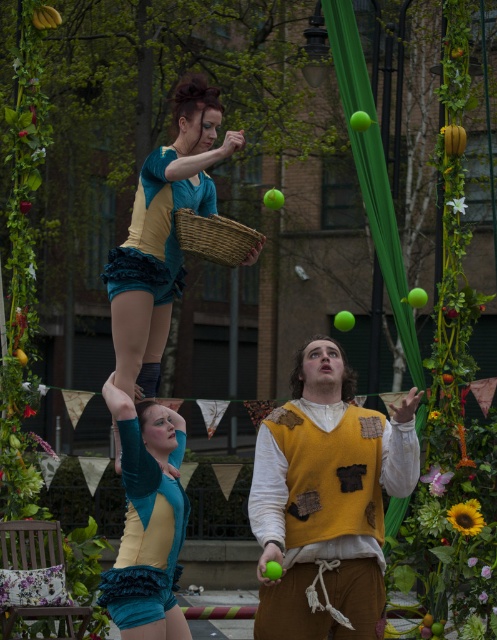
You are a photographer trying to capture a closeup of the teal ruffled shorts at upper center and the woven brown basket at center in the scene. Given that your camera can only focus on objects within 10 inches of each other, will both items be in focus?

The teal ruffled shorts at upper center and woven brown basket at center are 9.94 inches apart, which is within the 10 inch focus range. Therefore, both items will be in focus.

You are standing at the camera position and want to throw a small object to the teal ruffled shorts at upper center. If the maximum throwing distance you can achieve is 30 feet, will you be able to reach it?

The teal ruffled shorts at upper center is 33.18 feet away from camera. Since your maximum throwing distance is 30 feet, you cannot reach it.

You are a photographer positioned to capture the performers. You notice the matte yellow vest at center and the teal velvet shorts at lower left. Which object should you focus on first to ensure it appears larger in your photo?

The matte yellow vest at center should be focused on first because it is closer to the viewer, making it appear larger in the photo compared to the teal velvet shorts at lower left.